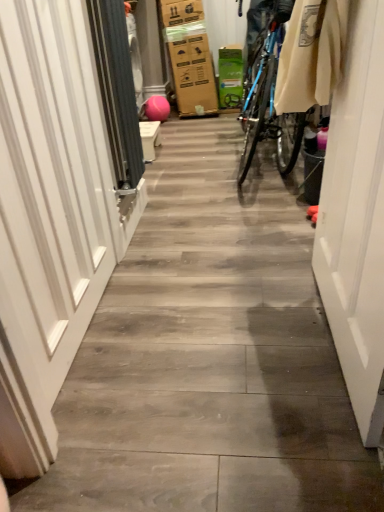
Question: From a real-world perspective, is gray fabric screen door at left physically located above or below white glossy door at right?

Choices:
 (A) below
 (B) above

Answer: (B)

Question: Considering the relative positions of gray fabric screen door at left and white glossy door at right in the image provided, is gray fabric screen door at left to the left or to the right of white glossy door at right?

Choices:
 (A) left
 (B) right

Answer: (A)

Question: Based on their relative distances, which object is farther from the gray fabric screen door at left?

Choices:
 (A) white glossy door at right
 (B) white glossy door at left

Answer: (A)

Question: Considering the real-world distances, which object is farthest from the white glossy door at right?

Choices:
 (A) white glossy door at left
 (B) gray fabric screen door at left

Answer: (B)